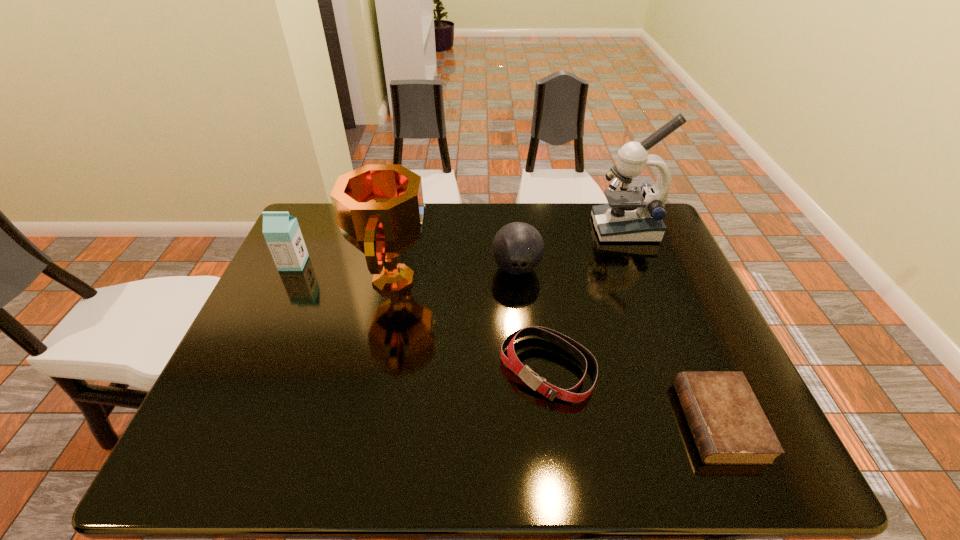
Locate an element on the screen. Image resolution: width=960 pixels, height=540 pixels. vacant space that is in between the dog collar and the bowling ball is located at coordinates (532, 318).

I want to click on vacant area that lies between the diary and the second object from left to right, so click(x=557, y=351).

Locate an element on the screen. The height and width of the screenshot is (540, 960). free space between the bowling ball and the fifth object from right to left is located at coordinates (456, 274).

Where is `vacant point located between the award and the shortest object`? Image resolution: width=960 pixels, height=540 pixels. vacant point located between the award and the shortest object is located at coordinates (557, 351).

This screenshot has height=540, width=960. In order to click on empty space that is in between the tallest object and the diary in this screenshot , I will do `click(672, 325)`.

You are a GUI agent. You are given a task and a screenshot of the screen. Output one action in this format:
    pyautogui.click(x=<x>, y=<y>)
    Task: Click on the blank region between the microscope and the fifth tallest object
    This screenshot has width=960, height=540.
    Given the screenshot: What is the action you would take?
    pyautogui.click(x=587, y=298)

In order to click on vacant area that lies between the diary and the award in this screenshot , I will do `click(557, 351)`.

Identify the location of the fourth closest object relative to the fourth tallest object. (729, 427).

Identify which object is the second closest to the diary. Please provide its 2D coordinates. Your answer should be formatted as a tuple, i.e. [(x, y)], where the tuple contains the x and y coordinates of a point satisfying the conditions above.

[(518, 248)]

This screenshot has height=540, width=960. Find the location of `free space that satisfies the following two spatial constraints: 1. on the side of the award with the star emblem; 2. on the back side of the second shortest object`. free space that satisfies the following two spatial constraints: 1. on the side of the award with the star emblem; 2. on the back side of the second shortest object is located at coordinates (377, 368).